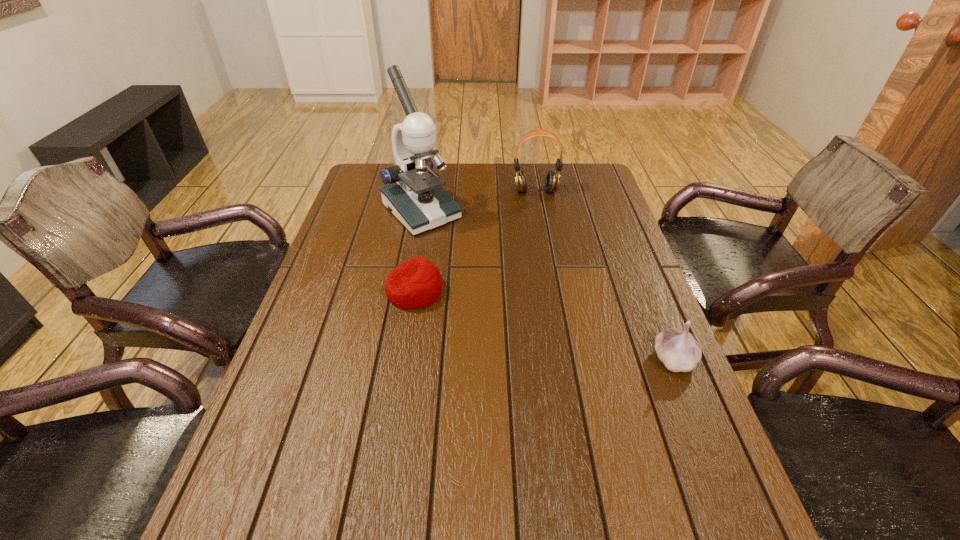
Image resolution: width=960 pixels, height=540 pixels. I want to click on vacant space in between the second shortest object and the microscope, so click(547, 285).

Identify the location of free spot between the microscope and the second shortest object. This screenshot has height=540, width=960. (547, 285).

Identify the location of free space between the microscope and the headset. This screenshot has height=540, width=960. (478, 201).

You are a GUI agent. You are given a task and a screenshot of the screen. Output one action in this format:
    pyautogui.click(x=<x>, y=<y>)
    Task: Click on the vacant area between the second object from right to left and the rightmost object
    
    Given the screenshot: What is the action you would take?
    pyautogui.click(x=604, y=275)

Where is `vacant point located between the third tallest object and the microscope`? This screenshot has width=960, height=540. vacant point located between the third tallest object and the microscope is located at coordinates (547, 285).

You are a GUI agent. You are given a task and a screenshot of the screen. Output one action in this format:
    pyautogui.click(x=<x>, y=<y>)
    Task: Click on the free spot between the tallest object and the garlic
    This screenshot has height=540, width=960.
    Given the screenshot: What is the action you would take?
    pyautogui.click(x=547, y=285)

I want to click on object that stands as the closest to the third tallest object, so click(416, 283).

Locate which object ranks in proximity to the third farthest object. Please provide its 2D coordinates. Your answer should be formatted as a tuple, i.e. [(x, y)], where the tuple contains the x and y coordinates of a point satisfying the conditions above.

[(415, 196)]

This screenshot has height=540, width=960. Identify the location of free space in the image that satisfies the following two spatial constraints: 1. on the front side of the microscope; 2. on the seat area of the shortest object. (407, 291).